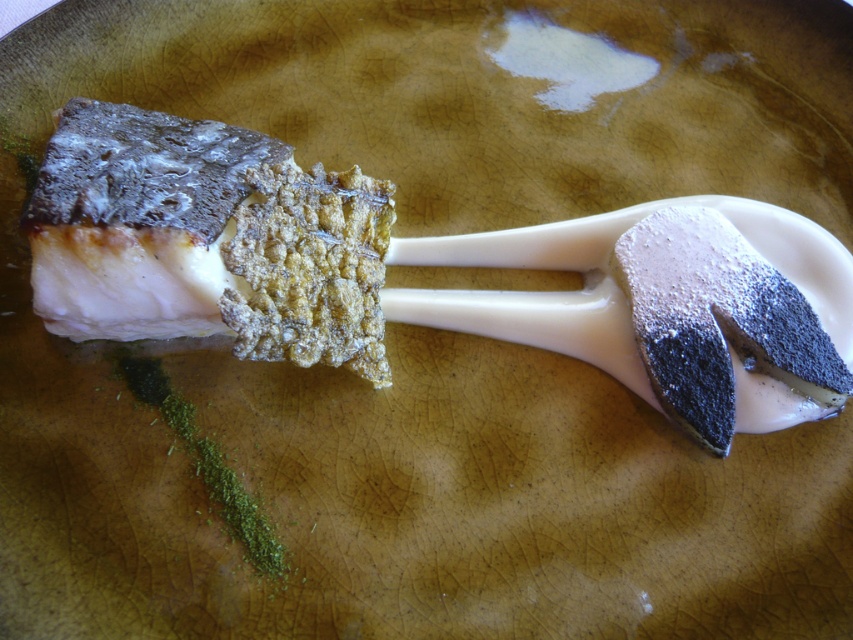
Measure the distance between white creamy fish at center and smooth white cream at center.

white creamy fish at center and smooth white cream at center are 19.49 inches apart.

Is point (79, 333) more distant than point (715, 410)?

No, it is in front of (715, 410).

The height and width of the screenshot is (640, 853). Find the location of `white creamy fish at center`. white creamy fish at center is located at coordinates (206, 240).